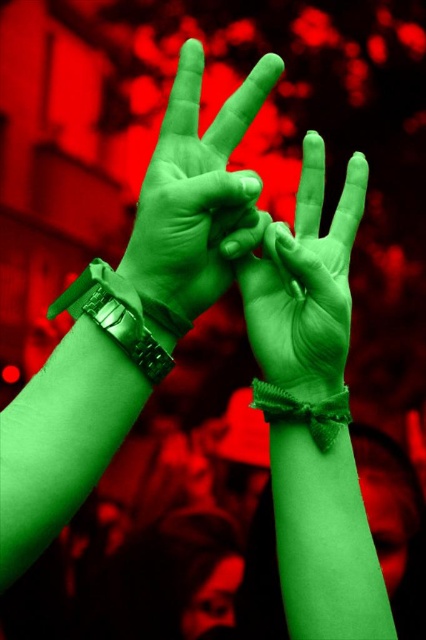
Question: Which is nearer to the green knitted wristband at center?

Choices:
 (A) metallic green wristband at left
 (B) green rubber glove at center
 (C) green rubber wristband at center

Answer: (B)

Question: Can you confirm if green rubber wristband at center is positioned above green rubber glove at center?

Choices:
 (A) yes
 (B) no

Answer: (A)

Question: Which of the following is the closest to the observer?

Choices:
 (A) green knitted wristband at center
 (B) green rubber glove at center

Answer: (B)

Question: Can you confirm if green rubber wristband at center is smaller than green rubber glove at center?

Choices:
 (A) yes
 (B) no

Answer: (A)

Question: Which object appears closest to the camera in this image?

Choices:
 (A) metallic green wristband at left
 (B) green rubber glove at center
 (C) green rubber wristband at center

Answer: (A)

Question: Is green rubber wristband at center wider than green knitted wristband at center?

Choices:
 (A) no
 (B) yes

Answer: (B)